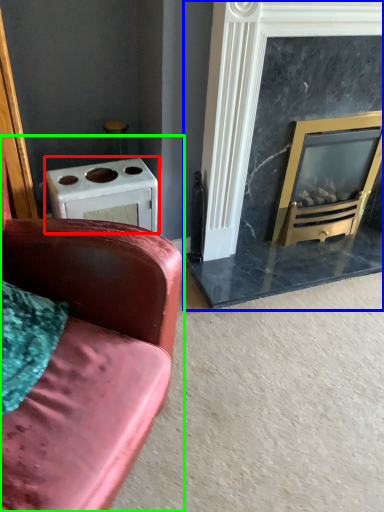
Question: Estimate the real-world distances between objects in this image. Which object is closer to appliance (highlighted by a red box), fireplace (highlighted by a blue box) or studio couch (highlighted by a green box)?

Choices:
 (A) fireplace
 (B) studio couch

Answer: (B)